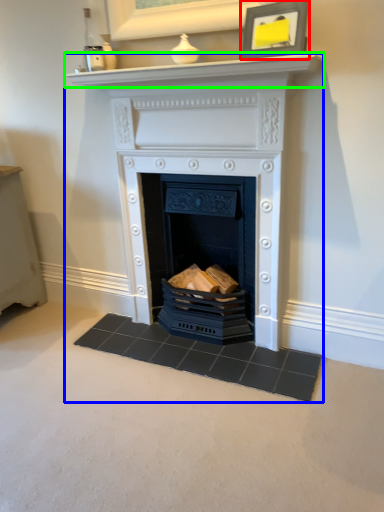
Question: Which object is the closest to the picture frame (highlighted by a red box)? Choose among these: fireplace (highlighted by a blue box) or mantle (highlighted by a green box).

Choices:
 (A) fireplace
 (B) mantle

Answer: (B)